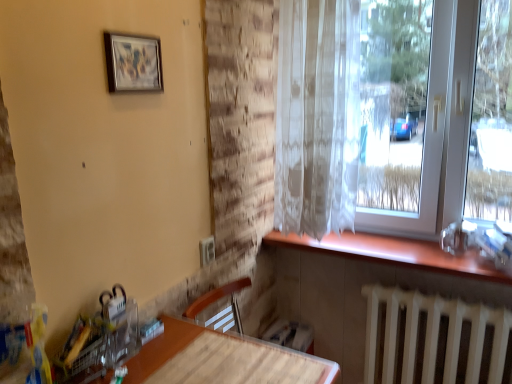
Question: Is the surface of matte wood table at lower left in direct contact with white metallic radiator at lower right?

Choices:
 (A) yes
 (B) no

Answer: (B)

Question: Can you confirm if matte wood table at lower left is taller than white metallic radiator at lower right?

Choices:
 (A) no
 (B) yes

Answer: (B)

Question: From a real-world perspective, does matte wood table at lower left sit lower than white metallic radiator at lower right?

Choices:
 (A) yes
 (B) no

Answer: (B)

Question: From the image's perspective, would you say matte wood table at lower left is positioned over white metallic radiator at lower right?

Choices:
 (A) no
 (B) yes

Answer: (B)

Question: Considering the relative sizes of matte wood table at lower left and white metallic radiator at lower right in the image provided, is matte wood table at lower left smaller than white metallic radiator at lower right?

Choices:
 (A) yes
 (B) no

Answer: (B)

Question: Is matte wood table at lower left facing away from white metallic radiator at lower right?

Choices:
 (A) yes
 (B) no

Answer: (B)

Question: Is wooden at lower right not close to matte wood table at lower left?

Choices:
 (A) no
 (B) yes

Answer: (A)

Question: Is wooden at lower right further to camera compared to matte wood table at lower left?

Choices:
 (A) yes
 (B) no

Answer: (A)

Question: Is wooden at lower right facing towards matte wood table at lower left?

Choices:
 (A) yes
 (B) no

Answer: (B)

Question: From a real-world perspective, is wooden at lower right located beneath matte wood table at lower left?

Choices:
 (A) no
 (B) yes

Answer: (B)

Question: Is wooden at lower right bigger than matte wood table at lower left?

Choices:
 (A) no
 (B) yes

Answer: (A)

Question: Can you confirm if wooden at lower right is thinner than matte wood table at lower left?

Choices:
 (A) no
 (B) yes

Answer: (A)

Question: Could you tell me if translucent white curtain at upper right is turned towards matte wood table at lower left?

Choices:
 (A) yes
 (B) no

Answer: (B)